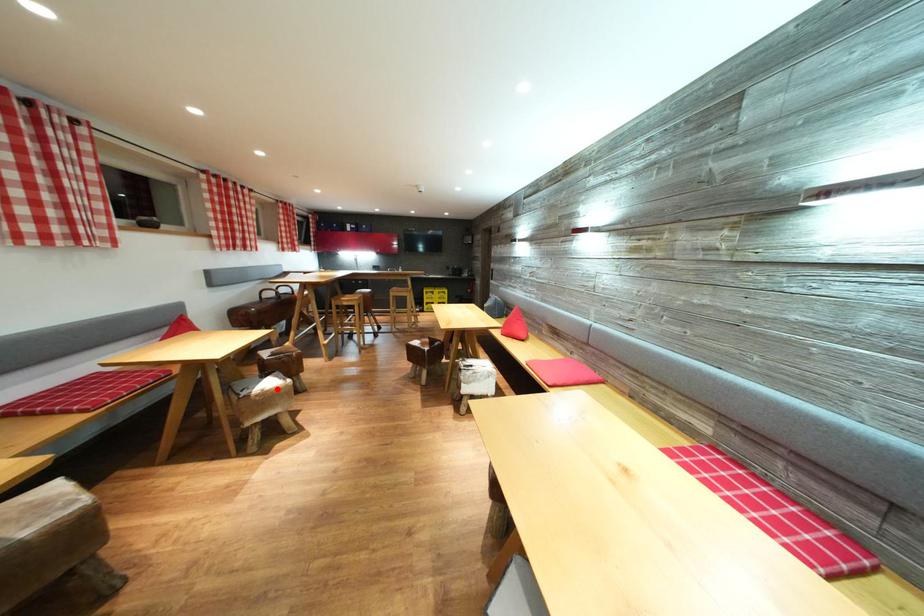
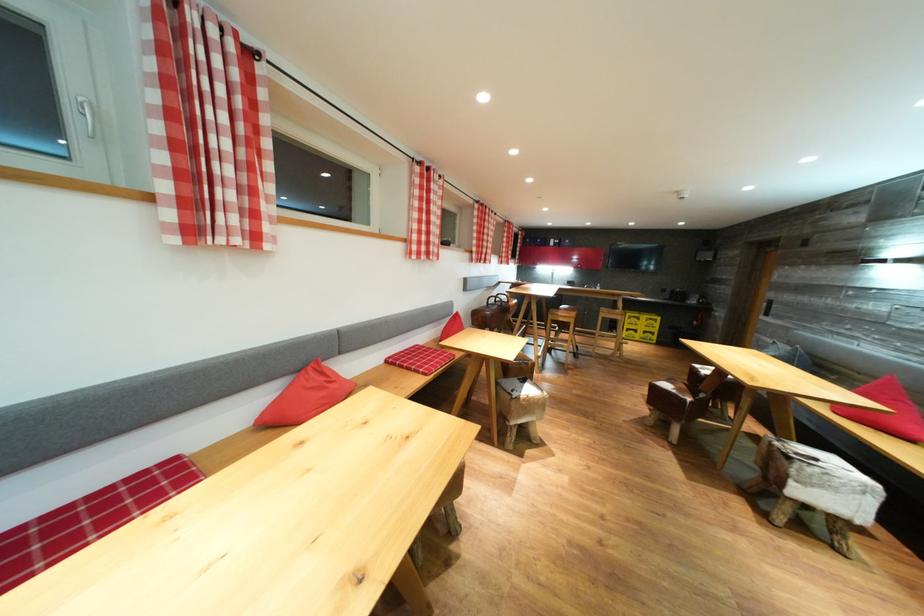
The point at the highlighted location is marked in the first image. Where is the corresponding point in the second image?

(536, 395)